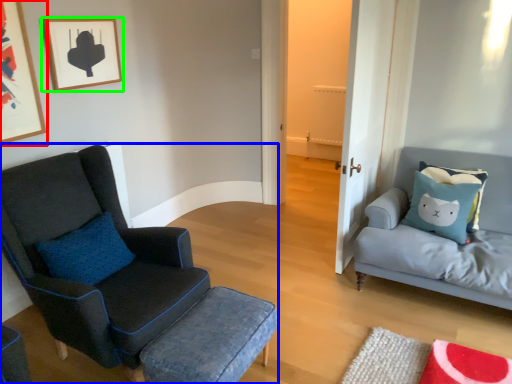
Question: Based on their relative distances, which object is farther from picture frame (highlighted by a red box)? Choose from chair (highlighted by a blue box) and picture frame (highlighted by a green box).

Choices:
 (A) chair
 (B) picture frame

Answer: (A)